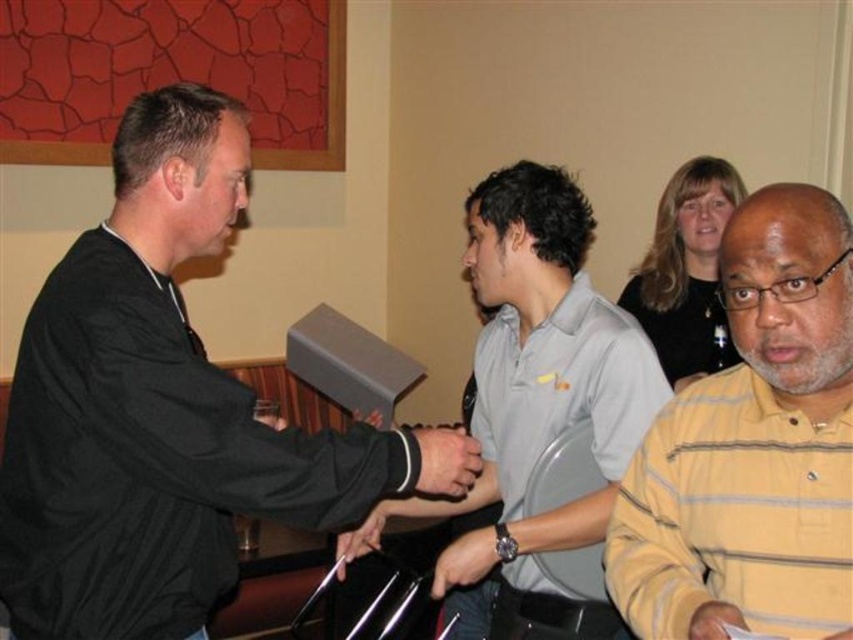
You are standing in the conference room and need to locate the black matte jacket at left. According to the coordinates provided, where would you find it?

The black matte jacket at left is located at coordinates point (155, 408).

You are standing in the conference room and need to locate two specific points for a presentation setup. The first point is at coordinates point (169, 218) and the second is at point (476, 470). Which point is closer to you when facing the room?

Point (169, 218) is in front of point (476, 470), so it is closer to you when facing the room.

You are a photographer standing 5 feet away from the two men shaking hands. You want to take a photo that includes both the yellow striped shirt at right and the man in the gray shirt. Will you be able to capture both in the same frame?

The two men are 39.17 inches apart, which is less than 5 feet, so yes, the photographer can capture both the yellow striped shirt at right and the man in the gray shirt in the same frame.